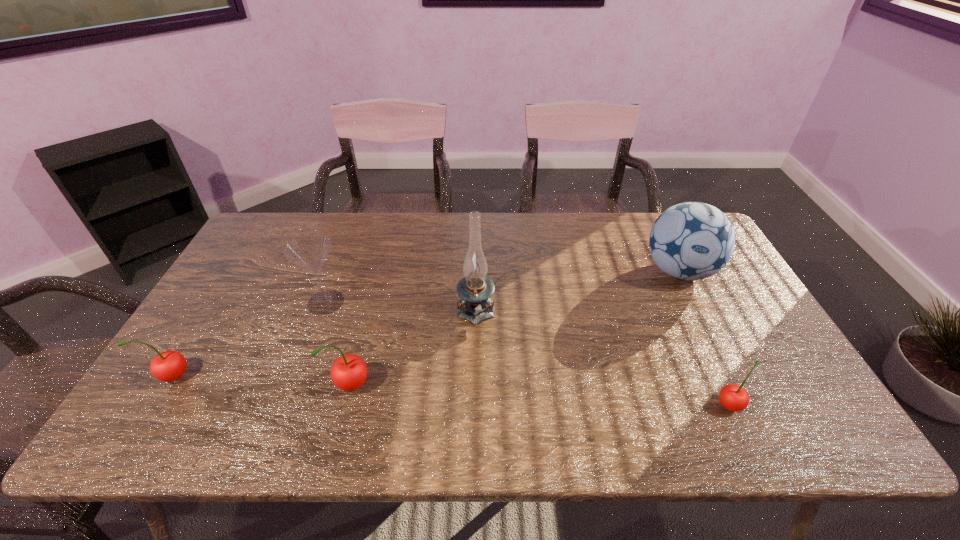
Locate an element on the screen. the leftmost cherry is located at coordinates (167, 366).

Locate an element on the screen. The height and width of the screenshot is (540, 960). the second tallest cherry is located at coordinates (167, 366).

What are the coordinates of `the second cherry from right to left` in the screenshot? It's located at (348, 372).

Locate an element on the screen. Image resolution: width=960 pixels, height=540 pixels. the shortest cherry is located at coordinates pyautogui.click(x=733, y=397).

You are a GUI agent. You are given a task and a screenshot of the screen. Output one action in this format:
    pyautogui.click(x=<x>, y=<y>)
    Task: Click on the shortest object
    This screenshot has width=960, height=540.
    Given the screenshot: What is the action you would take?
    pyautogui.click(x=733, y=397)

Find the location of a particular element. This screenshot has width=960, height=540. soccer ball is located at coordinates (690, 241).

This screenshot has width=960, height=540. Find the location of `the fifth object from right to left`. the fifth object from right to left is located at coordinates (310, 250).

This screenshot has width=960, height=540. In order to click on the tallest object in this screenshot , I will do `click(475, 289)`.

You are a GUI agent. You are given a task and a screenshot of the screen. Output one action in this format:
    pyautogui.click(x=<x>, y=<y>)
    Task: Click on the third object from right to left
    The width and height of the screenshot is (960, 540).
    Given the screenshot: What is the action you would take?
    pyautogui.click(x=475, y=289)

This screenshot has height=540, width=960. I want to click on blank space located 0.400m on the right of the leftmost object, so click(355, 376).